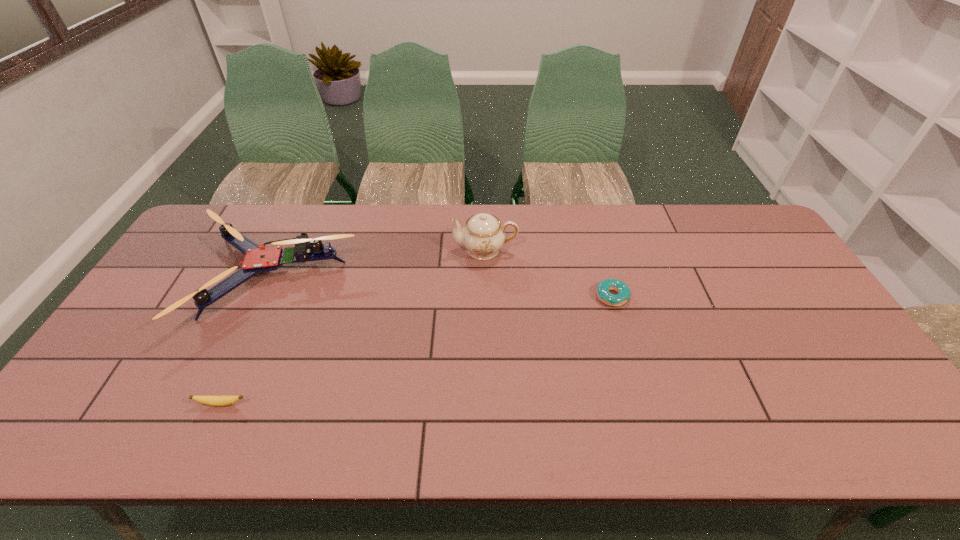
I want to click on chinaware, so (x=483, y=236).

What are the coordinates of `the tallest object` in the screenshot? It's located at (483, 236).

At what (x,y) coordinates should I click in order to perform the action: click on the third shortest object. Please return your answer as a coordinate pair (x, y). Looking at the image, I should click on (257, 259).

Identify the location of the rightmost object. The height and width of the screenshot is (540, 960). pyautogui.click(x=603, y=293).

The width and height of the screenshot is (960, 540). I want to click on the nearest object, so click(218, 401).

Identify the location of vacant space located 0.380m at the spout of the second object from right to left. The width and height of the screenshot is (960, 540). (335, 250).

Where is `free space located at the spout of the second object from right to left`? The height and width of the screenshot is (540, 960). free space located at the spout of the second object from right to left is located at coordinates (412, 250).

Locate an element on the screen. The height and width of the screenshot is (540, 960). vacant region located at the spout of the second object from right to left is located at coordinates (406, 250).

Locate an element on the screen. This screenshot has height=540, width=960. free region located on the right of the drone is located at coordinates (386, 278).

Identify the location of free spot located 0.060m on the right of the rightmost object. (649, 296).